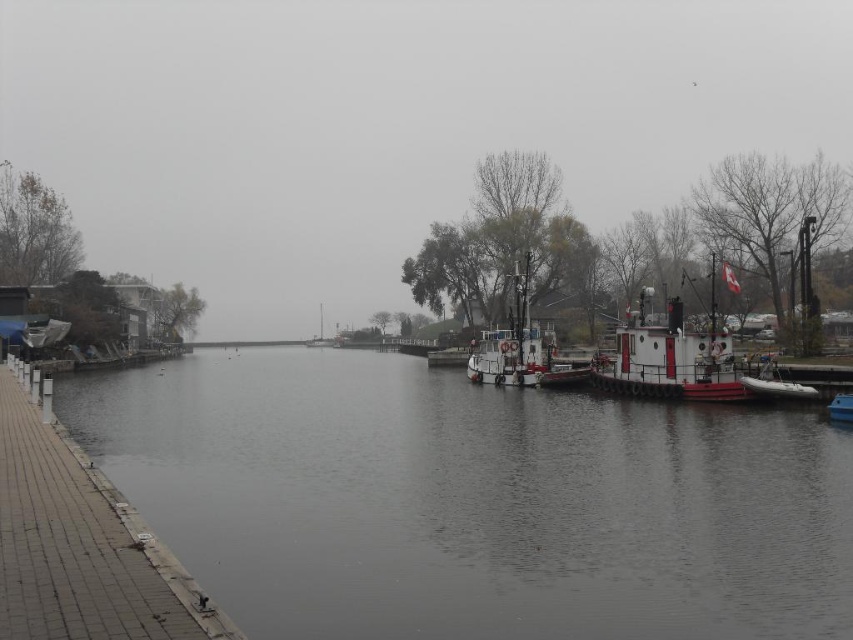
Can you confirm if gray concrete dock at lower left is positioned below white matte tugboat at right?

Yes.

At what (x,y) coordinates should I click in order to perform the action: click on gray concrete dock at lower left. Please return your answer as a coordinate pair (x, y). Looking at the image, I should click on (79, 545).

Between white matte tugboat at right and white plastic boat at right, which one is positioned higher?

white matte tugboat at right is higher up.

Can you confirm if white matte tugboat at right is positioned to the right of white plastic boat at right?

Correct, you'll find white matte tugboat at right to the right of white plastic boat at right.

What do you see at coordinates (672, 356) in the screenshot?
I see `white matte tugboat at right` at bounding box center [672, 356].

Where is `white matte tugboat at right`? The height and width of the screenshot is (640, 853). white matte tugboat at right is located at coordinates (672, 356).

Is the position of white matte tugboat at center less distant than that of white rubber dinghy at right?

No, it is not.

This screenshot has width=853, height=640. I want to click on white matte tugboat at center, so click(520, 346).